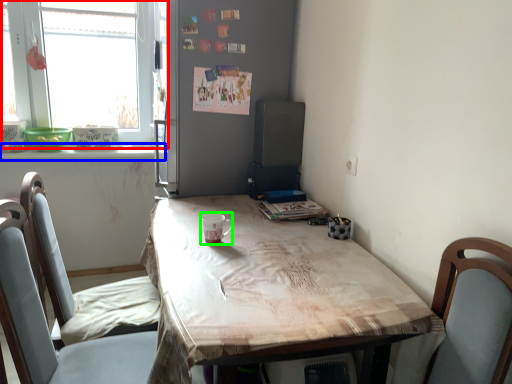
Question: Based on their relative distances, which object is farther from window (highlighted by a red box)? Choose from window sill (highlighted by a blue box) and coffee cup (highlighted by a green box).

Choices:
 (A) window sill
 (B) coffee cup

Answer: (B)